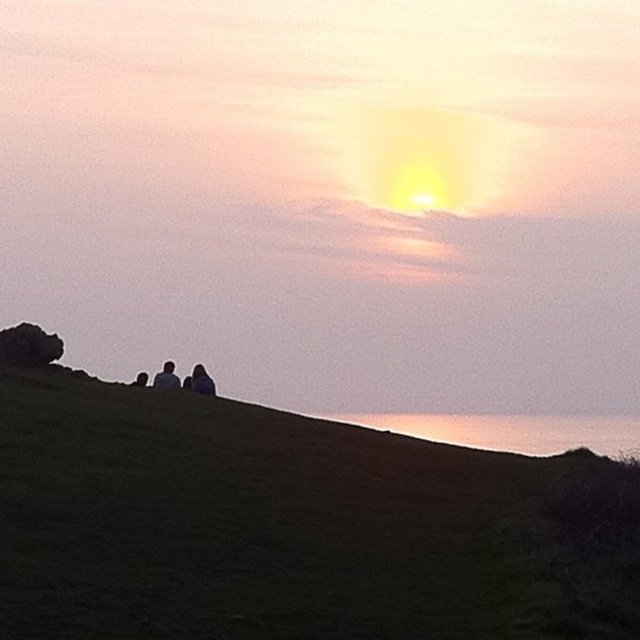
Question: Among these points, which one is farthest from the camera?

Choices:
 (A) (192, 378)
 (B) (147, 374)
 (C) (172, 364)

Answer: (C)

Question: Can you confirm if dark blue fabric at center is positioned to the left of dark gray sweater at center?

Choices:
 (A) yes
 (B) no

Answer: (B)

Question: Is dark blue fabric at center behind silhouette figure at center?

Choices:
 (A) no
 (B) yes

Answer: (A)

Question: Which object is closer to the camera taking this photo?

Choices:
 (A) silhouette figure at center
 (B) dark gray sweater at center

Answer: (B)

Question: Which of the following is the closest to the observer?

Choices:
 (A) silhouette figure at center
 (B) dark gray sweater at center
 (C) dark blue fabric at center

Answer: (C)

Question: Does dark gray sweater at center appear on the left side of silhouette figure at center?

Choices:
 (A) no
 (B) yes

Answer: (A)